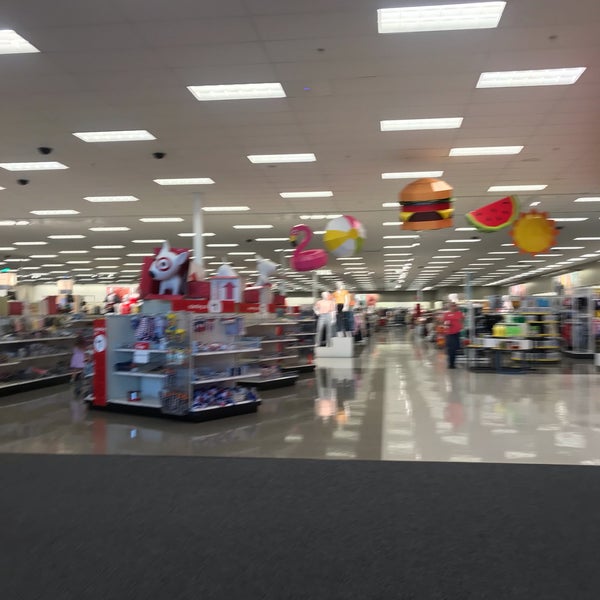
Identify the location of shelf 3. (303, 330).